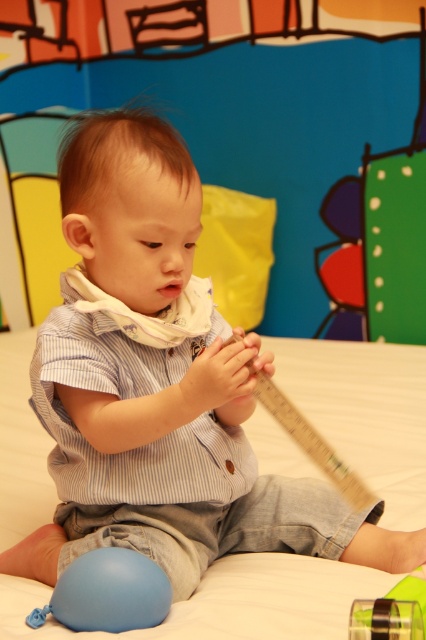
Question: Which point is farther to the camera?

Choices:
 (A) (85, 568)
 (B) (321, 461)

Answer: (B)

Question: Does blue rubber balloon at lower left appear under wooden ruler at center?

Choices:
 (A) yes
 (B) no

Answer: (A)

Question: Can you confirm if wooden ruler at center is smaller than transparent plastic tape at lower right?

Choices:
 (A) yes
 (B) no

Answer: (B)

Question: Which of the following is the closest to the observer?

Choices:
 (A) transparent plastic tape at lower right
 (B) blue rubber balloon at lower left
 (C) wooden ruler at center

Answer: (A)

Question: Considering the relative positions of blue rubber balloon at lower left and transparent plastic tape at lower right in the image provided, where is blue rubber balloon at lower left located with respect to transparent plastic tape at lower right?

Choices:
 (A) right
 (B) left

Answer: (B)

Question: Which of the following is the farthest from the observer?

Choices:
 (A) (382, 632)
 (B) (118, 573)

Answer: (B)